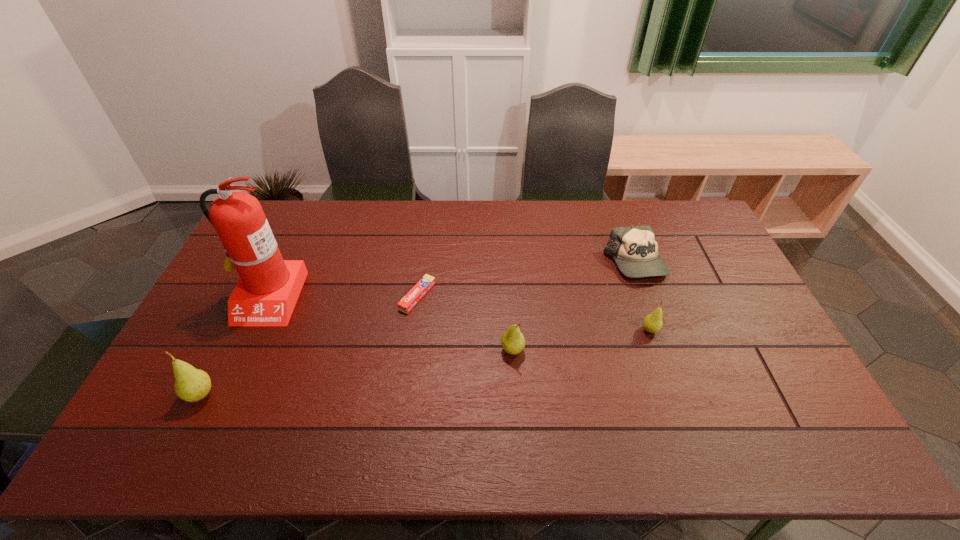
Where is `the tallest pear`? the tallest pear is located at coordinates (191, 384).

At what (x,y) coordinates should I click in order to perform the action: click on the leftmost pear. Please return your answer as a coordinate pair (x, y). This screenshot has height=540, width=960. Looking at the image, I should click on (191, 384).

The image size is (960, 540). What are the coordinates of `the second tallest pear` in the screenshot? It's located at 513,342.

Identify the location of the third tallest object. This screenshot has height=540, width=960. (513, 342).

Where is `the rightmost pear`? the rightmost pear is located at coordinates (652, 323).

Locate an element on the screen. The image size is (960, 540). the shortest pear is located at coordinates (652, 323).

This screenshot has width=960, height=540. What are the coordinates of `baseball cap` in the screenshot? It's located at (635, 250).

You are a GUI agent. You are given a task and a screenshot of the screen. Output one action in this format:
    pyautogui.click(x=<x>, y=<y>)
    Task: Click on the toothpaste
    
    Given the screenshot: What is the action you would take?
    pyautogui.click(x=408, y=302)

Image resolution: width=960 pixels, height=540 pixels. I want to click on the shortest object, so click(408, 302).

Locate an element on the screen. This screenshot has height=540, width=960. fire extinguisher is located at coordinates (265, 295).